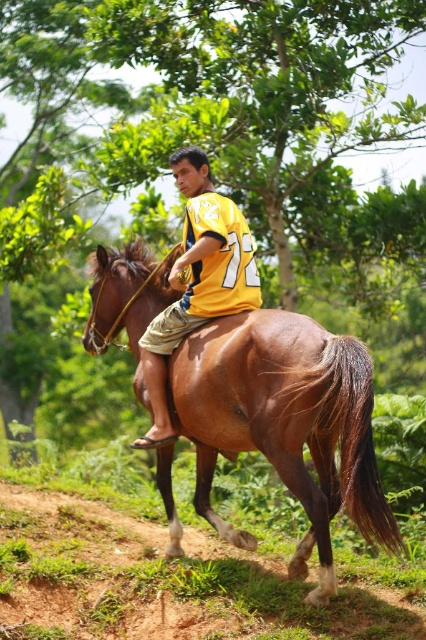
Who is more forward, (224, 436) or (150, 330)?

Point (224, 436) is in front.

Does brown glossy horse at center appear on the left side of yellow jersey at center?

In fact, brown glossy horse at center is to the right of yellow jersey at center.

Does point (328, 339) come farther from viewer compared to point (152, 410)?

No, it is not.

At what (x,y) coordinates should I click in order to perform the action: click on brown glossy horse at center. Please return your answer as a coordinate pair (x, y). The image size is (426, 640). Looking at the image, I should click on (284, 422).